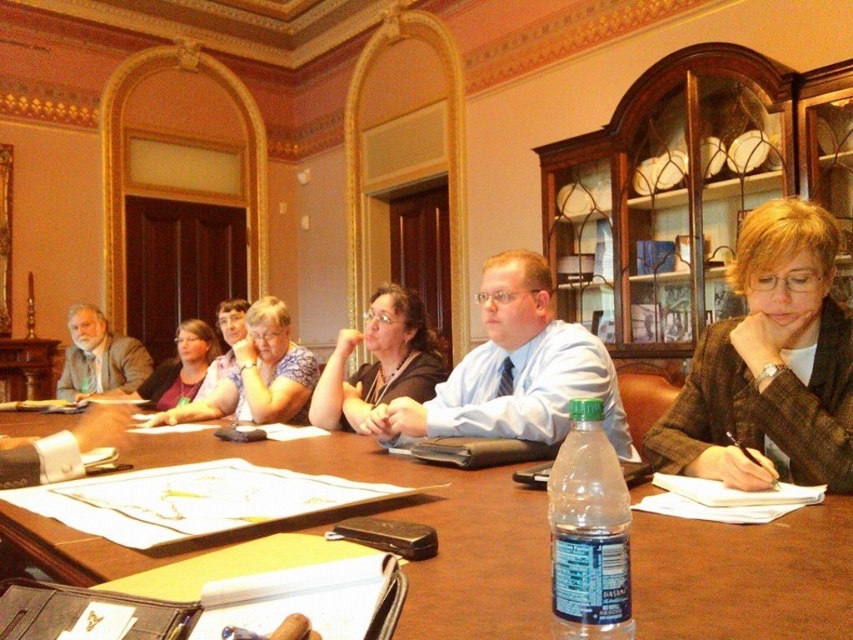
You are organizing a meeting in this room and need to place a large presentation screen. The screen requires more space than the brown wooden table at center. Can the matte gray suit at left be moved to accommodate the screen?

The brown wooden table at center occupies less space than the matte gray suit at left. Since the screen requires more space than the brown wooden table at center, the matte gray suit at left, which takes up more space, would need to be moved to make room for the screen.

You are a guest entering the conference room and need to sit at the brown wooden table at center. There is a person wearing the floral blouse at center already seated. Can you comfortably sit at the table without needing to adjust your posture?

The brown wooden table at center has a lesser height compared to floral blouse at center, which likely indicates that the table is lower than the average chair height. This may require you to adjust your posture slightly to sit comfortably.

You are attending a meeting in this conference room and notice both the brown wooden table at center and the matte pink sweater at center. Which object is closer to the ceiling?

The brown wooden table at center is positioned under the matte pink sweater at center, so the matte pink sweater at center is closer to the ceiling.